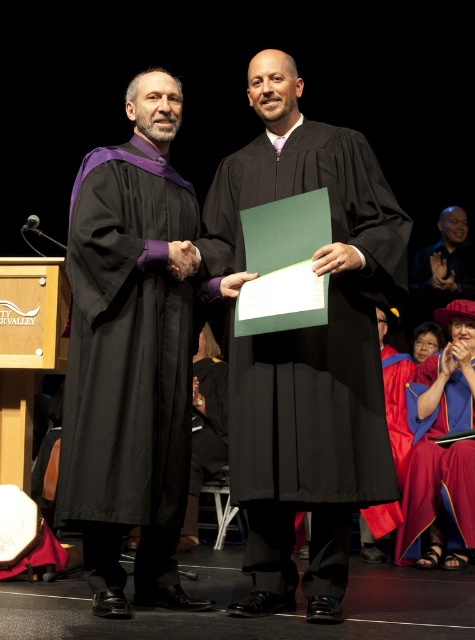
Question: Among these objects, which one is nearest to the camera?

Choices:
 (A) velvet maroon gown at lower right
 (B) bald head at center
 (C) velvet red graduation gown at lower right

Answer: (A)

Question: Does velvet maroon gown at lower right have a smaller size compared to bald head at center?

Choices:
 (A) no
 (B) yes

Answer: (A)

Question: Considering the real-world distances, which object is farthest from the matte black gown at center?

Choices:
 (A) velvet red graduation gown at lower right
 (B) bald head at center
 (C) velvet maroon gown at lower right

Answer: (B)

Question: Can you confirm if matte black gown at center is thinner than velvet red graduation gown at lower right?

Choices:
 (A) no
 (B) yes

Answer: (A)

Question: Considering the relative positions of matte black gown at center and bald head at center in the image provided, where is matte black gown at center located with respect to bald head at center?

Choices:
 (A) below
 (B) above

Answer: (A)

Question: Which object is closer to the camera taking this photo?

Choices:
 (A) bald head at center
 (B) velvet maroon gown at lower right
 (C) black matte graduation gown at center

Answer: (C)